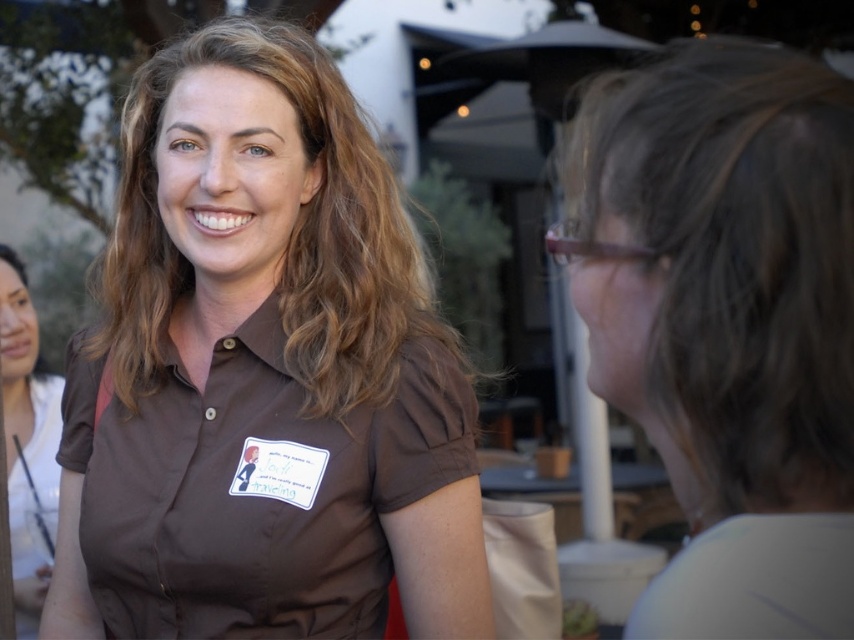
Question: Which point is farther to the camera?

Choices:
 (A) (665, 332)
 (B) (129, 292)

Answer: (B)

Question: Which of the following is the farthest from the observer?

Choices:
 (A) (6, 348)
 (B) (474, 401)
 (C) (834, 275)

Answer: (A)

Question: Does brown cotton shirt at center have a lesser width compared to matte brown shirt at left?

Choices:
 (A) no
 (B) yes

Answer: (B)

Question: Among these points, which one is farthest from the camera?

Choices:
 (A) (20, 595)
 (B) (431, 394)
 (C) (179, 74)

Answer: (A)

Question: Is gray matte hair at right thinner than matte brown shirt at left?

Choices:
 (A) yes
 (B) no

Answer: (A)

Question: Does brown cotton shirt at center appear on the right side of matte brown shirt at left?

Choices:
 (A) yes
 (B) no

Answer: (A)